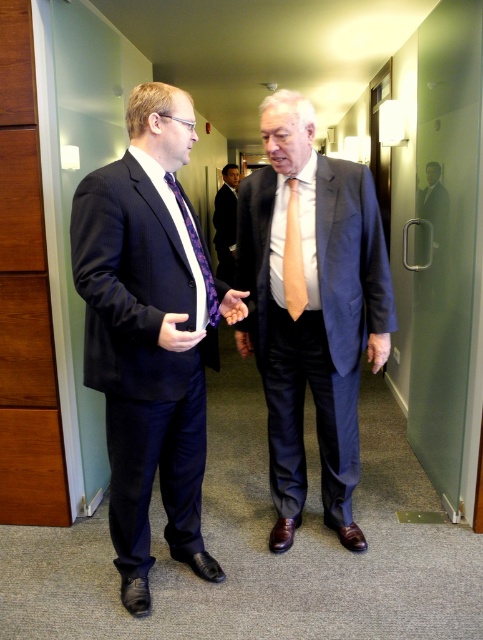
You are a photographer standing in the hallway. You want to take a closeup photo of the purple satin tie at center and the matte black hand at center. If your camera can only focus on objects within 10 inches of each other, will both objects be in focus?

The purple satin tie at center is 10.49 inches from the matte black hand at center, which is slightly beyond the 10 inch focus range. Therefore, both objects may not be in focus simultaneously.

You are standing in the hallway and want to locate the orange silk tie at center. According to the coordinates provided, where should you look?

The orange silk tie at center is located at point 0.402 on the x axis and 0.609 on the y axis.

You are an office assistant who needs to arrange two items in a display case. The items are the satin blue suit at center and the smooth orange hand at center. The display case has a height limit of 1.5 meters. Can both items fit vertically in the display case if placed side by side?

The satin blue suit at center is taller than the smooth orange hand at center. If the tallest item, the satin blue suit at center, is under 1.5 meters, both can fit. However, if the satin blue suit at center exceeds 1.5 meters, it won